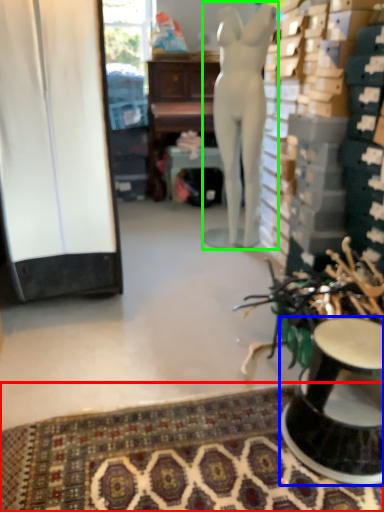
Question: Which object is the farthest from mat (highlighted by a red box)? Choose among these: furniture (highlighted by a blue box) or person (highlighted by a green box).

Choices:
 (A) furniture
 (B) person

Answer: (B)